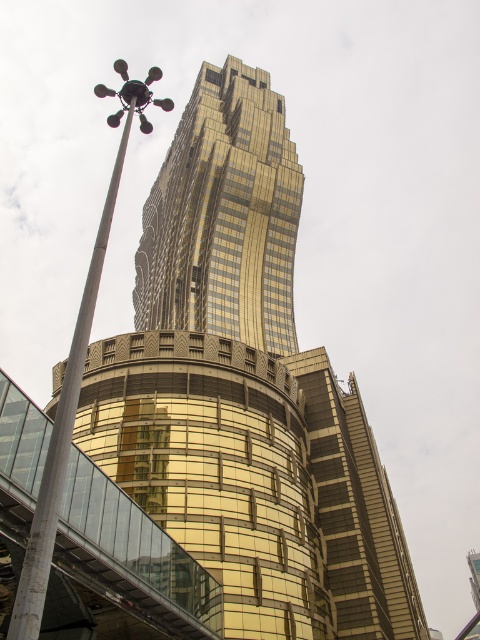
Question: Which object appears closest to the camera in this image?

Choices:
 (A) gold reflective glass tower at center
 (B) polished metal pole at center-left

Answer: (B)

Question: Observing the image, what is the correct spatial positioning of gold reflective glass tower at center in reference to polished metal pole at center-left?

Choices:
 (A) below
 (B) above

Answer: (A)

Question: Can you confirm if gold reflective glass tower at center is positioned below polished metal pole at center-left?

Choices:
 (A) no
 (B) yes

Answer: (B)

Question: Does gold reflective glass tower at center have a lesser width compared to polished metal pole at center-left?

Choices:
 (A) no
 (B) yes

Answer: (B)